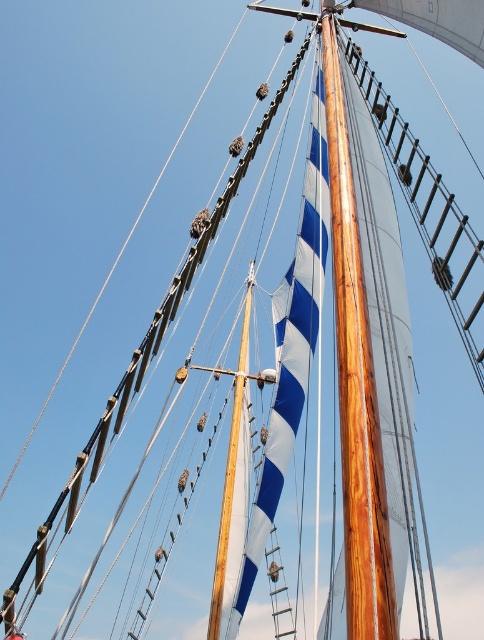
Between shiny polished wood mast at center and wooden mast at center, which one has less height?

Standing shorter between the two is shiny polished wood mast at center.

Does shiny polished wood mast at center have a lesser height compared to wooden mast at center?

Correct, shiny polished wood mast at center is not as tall as wooden mast at center.

This screenshot has width=484, height=640. What are the coordinates of `shiny polished wood mast at center` in the screenshot? It's located at (356, 388).